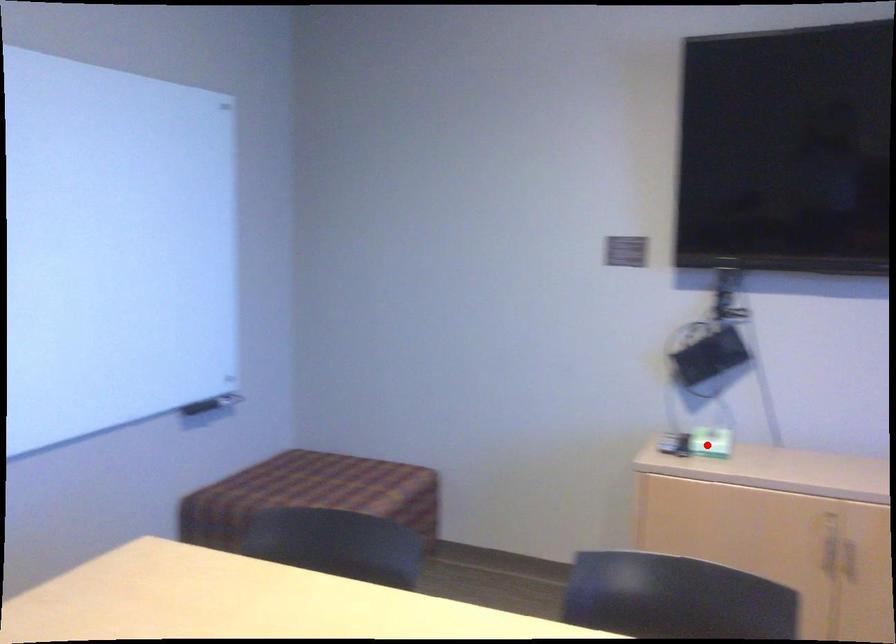
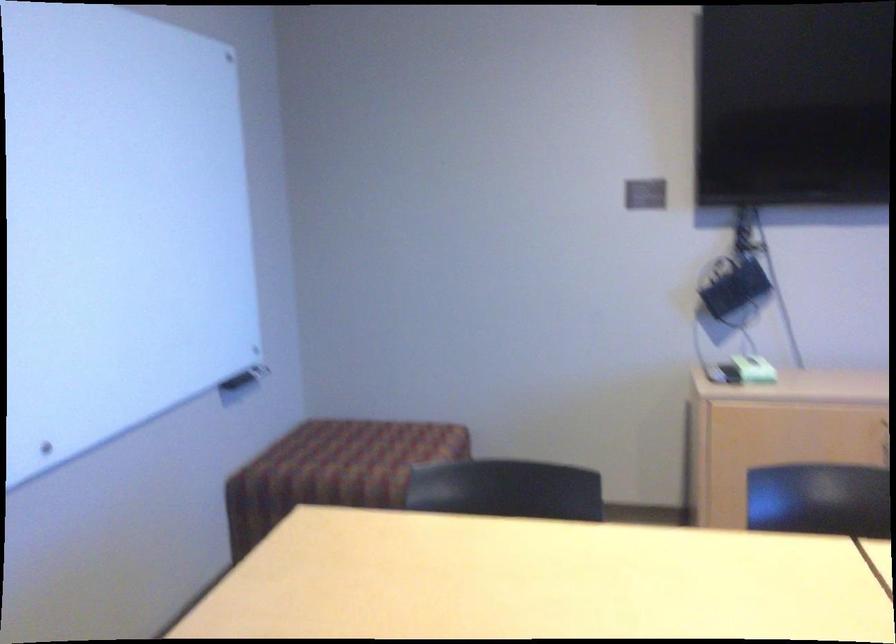
Locate, in the second image, the point that corresponds to the highlighted location in the first image.

(754, 368)